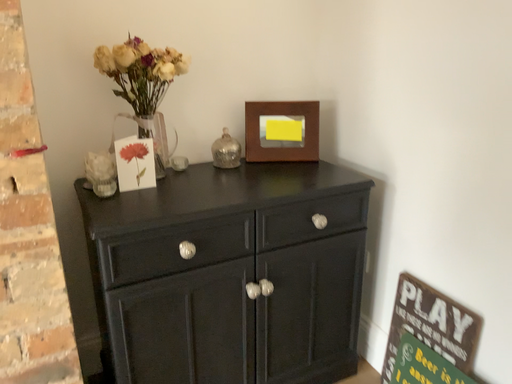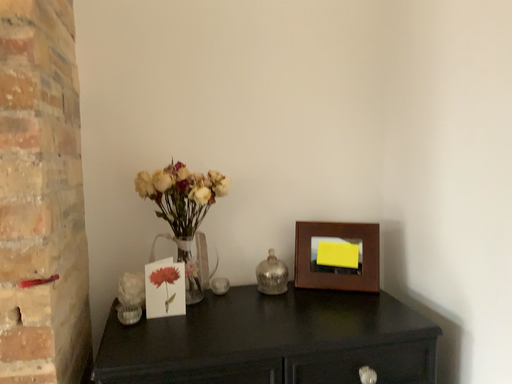
Question: Which way did the camera rotate in the video?

Choices:
 (A) rotated upward
 (B) rotated downward

Answer: (A)